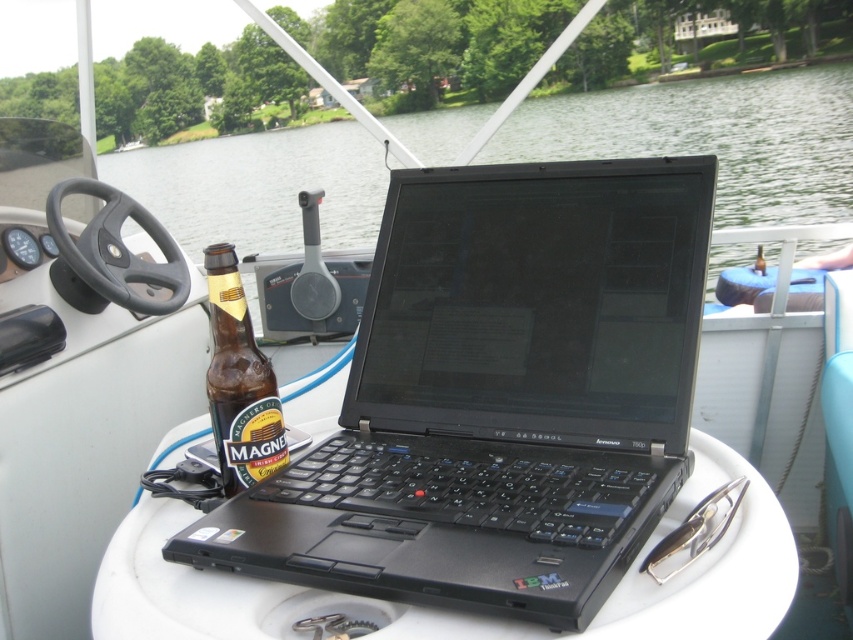
Is point (698, 465) positioned in front of point (239, 344)?

No, (698, 465) is behind (239, 344).

Find the location of `white plastic table at center`. white plastic table at center is located at coordinates (460, 611).

Can you confirm if clear water at center is taller than white plastic table at center?

Yes.

Which of these two, clear water at center or white plastic table at center, stands shorter?

white plastic table at center

Locate an element on the screen. Image resolution: width=853 pixels, height=640 pixels. clear water at center is located at coordinates (712, 138).

Where is `clear water at center`? clear water at center is located at coordinates (712, 138).

Who is higher up, black plastic laptop at center or white plastic table at center?

Positioned higher is black plastic laptop at center.

Is black plastic laptop at center taller than white plastic table at center?

Yes.

Is point (451, 540) closer to camera compared to point (194, 609)?

Yes.

Image resolution: width=853 pixels, height=640 pixels. I want to click on black plastic laptop at center, so click(x=498, y=396).